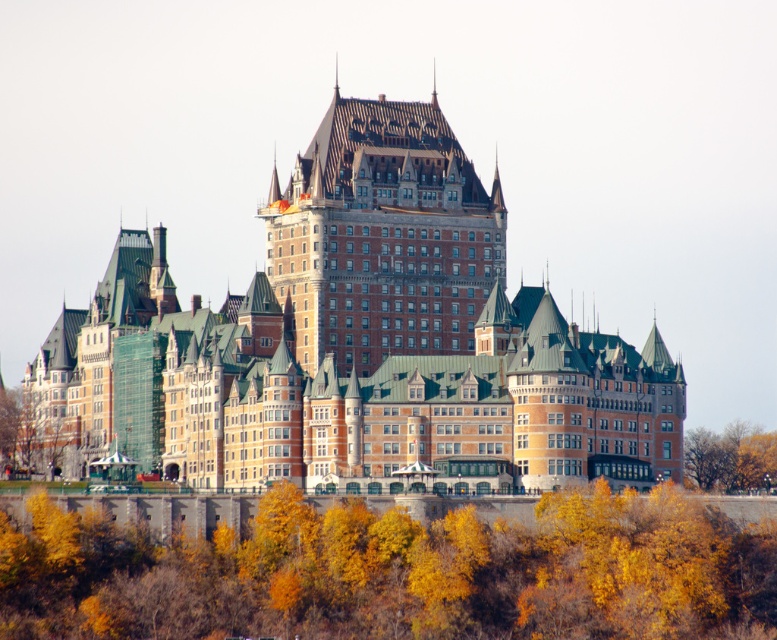
I want to click on brown stone castle at center, so click(x=371, y=339).

Is yellow leafy trees at center above yellow-green leaves at lower right?

No, yellow leafy trees at center is not above yellow-green leaves at lower right.

Between point (549, 524) and point (741, 436), which one is positioned behind?

The point (741, 436) is more distant.

Where is `yellow leafy trees at center`? The image size is (777, 640). yellow leafy trees at center is located at coordinates (396, 573).

From the picture: Is brown wooden tower at center wider than yellow-green leaves at lower right?

Yes, brown wooden tower at center is wider than yellow-green leaves at lower right.

What do you see at coordinates (382, 236) in the screenshot? Image resolution: width=777 pixels, height=640 pixels. I see `brown wooden tower at center` at bounding box center [382, 236].

Describe the element at coordinates (382, 236) in the screenshot. This screenshot has height=640, width=777. I see `brown wooden tower at center` at that location.

The image size is (777, 640). In order to click on brown wooden tower at center in this screenshot , I will do `click(382, 236)`.